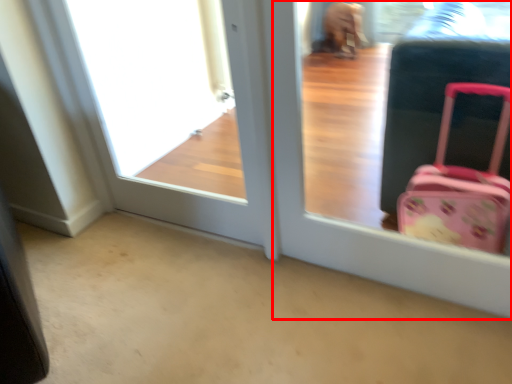
Question: From the image's perspective, where is screen door (annotated by the red box) located in relation to window frame in the image?

Choices:
 (A) above
 (B) below

Answer: (B)